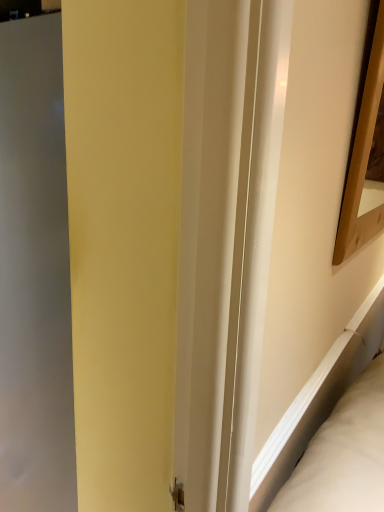
This screenshot has height=512, width=384. Describe the element at coordinates (362, 158) in the screenshot. I see `wooden picture frame at upper right` at that location.

Measure the distance between point (356, 242) and camera.

Point (356, 242) is 1.04 meters away from camera.

This screenshot has height=512, width=384. Find the location of `wooden picture frame at upper right`. wooden picture frame at upper right is located at coordinates (362, 158).

From the picture: In order to face matte gray screen door at left, should I rotate leftwards or rightwards?

A 20.477 degree turn to the left will do.

Describe the element at coordinates (34, 274) in the screenshot. I see `matte gray screen door at left` at that location.

Identify the location of matte gray screen door at left. (34, 274).

Locate an element on the screen. This screenshot has height=512, width=384. wooden picture frame at upper right is located at coordinates (362, 158).

Considering the positions of objects wooden picture frame at upper right and matte gray screen door at left in the image provided, who is more to the right, wooden picture frame at upper right or matte gray screen door at left?

Positioned to the right is wooden picture frame at upper right.

In the image, is wooden picture frame at upper right positioned in front of or behind matte gray screen door at left?

wooden picture frame at upper right is positioned closer to the viewer than matte gray screen door at left.

Which point is more distant from viewer, (x=353, y=151) or (x=49, y=14)?

Positioned behind is point (x=353, y=151).

From the image's perspective, is wooden picture frame at upper right positioned above or below matte gray screen door at left?

wooden picture frame at upper right is situated higher than matte gray screen door at left in the image.

From a real-world perspective, is wooden picture frame at upper right positioned under matte gray screen door at left based on gravity?

No, from a real-world perspective, wooden picture frame at upper right is not under matte gray screen door at left.

Which object is wider, wooden picture frame at upper right or matte gray screen door at left?

matte gray screen door at left is wider.

Which of these two, wooden picture frame at upper right or matte gray screen door at left, stands taller?

matte gray screen door at left.

Who is smaller, wooden picture frame at upper right or matte gray screen door at left?

With smaller size is wooden picture frame at upper right.

Is wooden picture frame at upper right positioned beyond the bounds of matte gray screen door at left?

Absolutely, wooden picture frame at upper right is external to matte gray screen door at left.

Is wooden picture frame at upper right far from matte gray screen door at left?

No, wooden picture frame at upper right is not far away from matte gray screen door at left.

Is wooden picture frame at upper right aimed at matte gray screen door at left?

No, wooden picture frame at upper right is not aimed at matte gray screen door at left.

What's the angular difference between wooden picture frame at upper right and matte gray screen door at left's facing directions?

The angular difference between wooden picture frame at upper right and matte gray screen door at left is 91.4 degrees.

You are a GUI agent. You are given a task and a screenshot of the screen. Output one action in this format:
    pyautogui.click(x=<x>, y=<y>)
    Task: Click on the picture frame that appears in front of the matte gray screen door at left
    Image resolution: width=384 pixels, height=512 pixels.
    Given the screenshot: What is the action you would take?
    pyautogui.click(x=362, y=158)

Does matte gray screen door at left appear on the left side of wooden picture frame at upper right?

Yes, matte gray screen door at left is to the left of wooden picture frame at upper right.

Considering their positions, is matte gray screen door at left located in front of or behind wooden picture frame at upper right?

Clearly, matte gray screen door at left is behind wooden picture frame at upper right.

Is point (39, 16) closer to viewer compared to point (362, 105)?

Yes, it is.

From the image's perspective, is matte gray screen door at left above or below wooden picture frame at upper right?

matte gray screen door at left is situated lower than wooden picture frame at upper right in the image.

From a real-world perspective, which object stands above the other?

wooden picture frame at upper right, from a real-world perspective.

Considering the relative sizes of matte gray screen door at left and wooden picture frame at upper right in the image provided, is matte gray screen door at left wider than wooden picture frame at upper right?

Yes, matte gray screen door at left is wider than wooden picture frame at upper right.

Is matte gray screen door at left shorter than wooden picture frame at upper right?

No, matte gray screen door at left is not shorter than wooden picture frame at upper right.

Considering the sizes of objects matte gray screen door at left and wooden picture frame at upper right in the image provided, who is bigger, matte gray screen door at left or wooden picture frame at upper right?

matte gray screen door at left is bigger.

Can we say matte gray screen door at left lies outside wooden picture frame at upper right?

That's correct, matte gray screen door at left is outside of wooden picture frame at upper right.

Is matte gray screen door at left positioned far away from wooden picture frame at upper right?

No.

Could you tell me if matte gray screen door at left is facing wooden picture frame at upper right?

No, matte gray screen door at left is not aimed at wooden picture frame at upper right.

What's the angular difference between matte gray screen door at left and wooden picture frame at upper right's facing directions?

91.4 degrees separate the facing orientations of matte gray screen door at left and wooden picture frame at upper right.

Locate an element on the screen. The width and height of the screenshot is (384, 512). picture frame that is above the matte gray screen door at left (from the image's perspective) is located at coordinates (362, 158).

Where is `screen door on the left of wooden picture frame at upper right`? This screenshot has height=512, width=384. screen door on the left of wooden picture frame at upper right is located at coordinates (34, 274).

The image size is (384, 512). Identify the location of picture frame lying in front of the matte gray screen door at left. (362, 158).